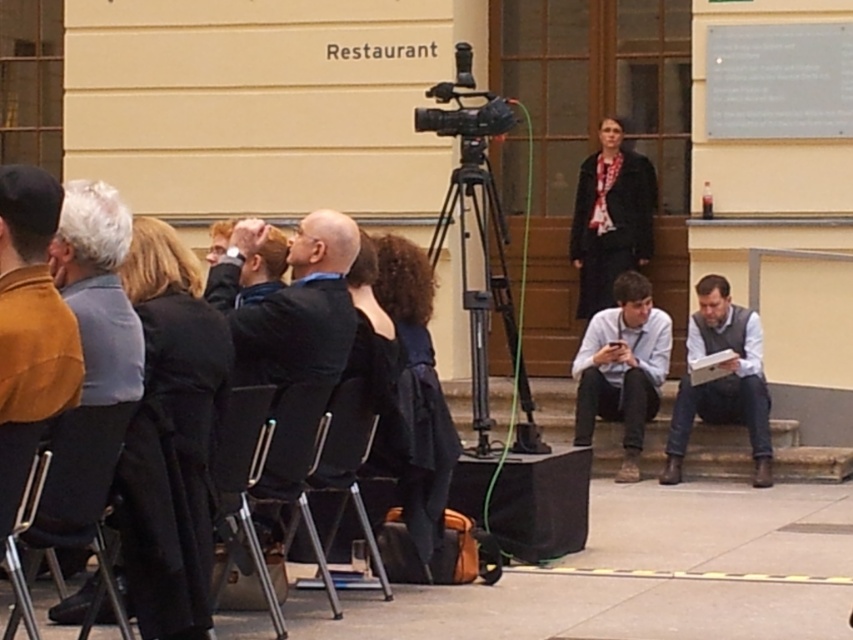
You are an event organizer who needs to ensure the speaker can move freely during their presentation. Given the black suit at center and the black metal tripod at center, which object is closer to the speaker and might require adjustment to allow movement?

The black suit at center is in front of the black metal tripod at center, so the black suit at center is closer to the speaker and might require adjustment to allow movement.

You are organizing a small presentation and need to place a gray metallic plaque at upper right and a metallic gray chair at lower left. Given their sizes, which object will require more horizontal space?

The gray metallic plaque at upper right requires more horizontal space because its width surpasses that of the metallic gray chair at lower left.